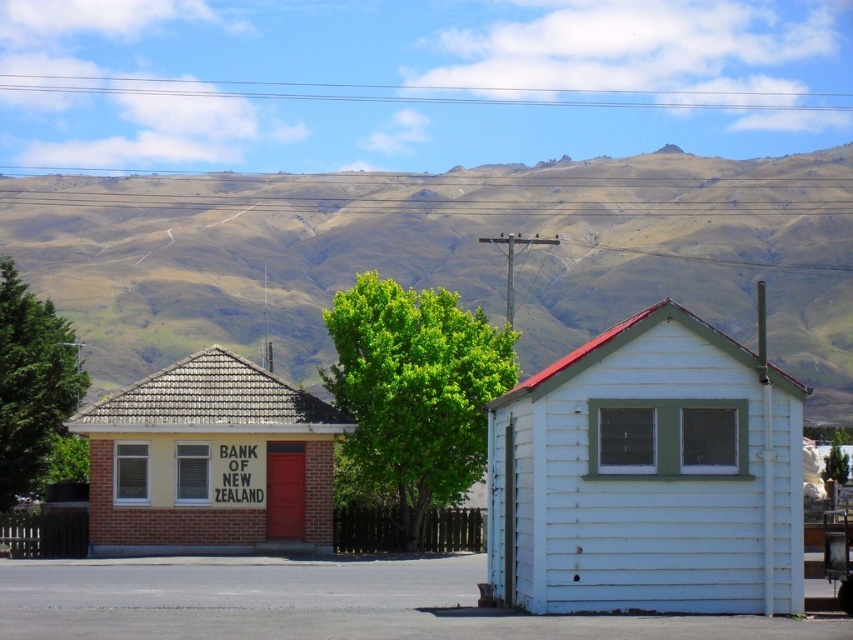
Question: Does brown grassy hillside at upper center have a smaller size compared to yellow brick building at center?

Choices:
 (A) no
 (B) yes

Answer: (A)

Question: Can you confirm if white wood cabin at center is positioned above yellow brick building at center?

Choices:
 (A) yes
 (B) no

Answer: (A)

Question: Does yellow brick building at center have a larger size compared to green leafy tree at left?

Choices:
 (A) yes
 (B) no

Answer: (B)

Question: Which of the following is the farthest from the observer?

Choices:
 (A) (117, 349)
 (B) (421, 547)

Answer: (A)

Question: Which object is closer to the camera taking this photo?

Choices:
 (A) brown grassy hillside at upper center
 (B) white wood cabin at center
 (C) green leafy tree at center

Answer: (B)

Question: Estimate the real-world distances between objects in this image. Which object is closer to the yellow brick building at center?

Choices:
 (A) white wood cabin at center
 (B) green leafy tree at center
 (C) green leafy tree at left

Answer: (B)